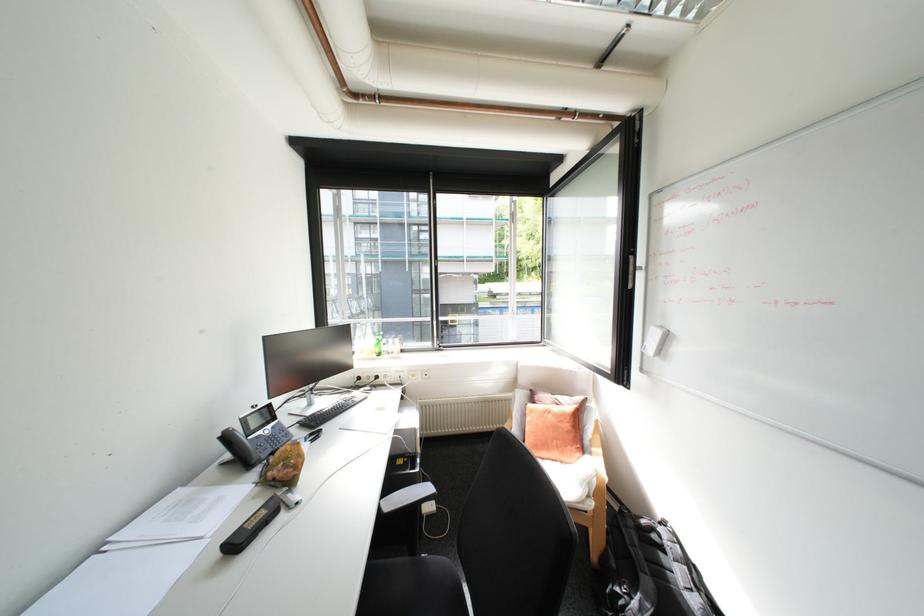
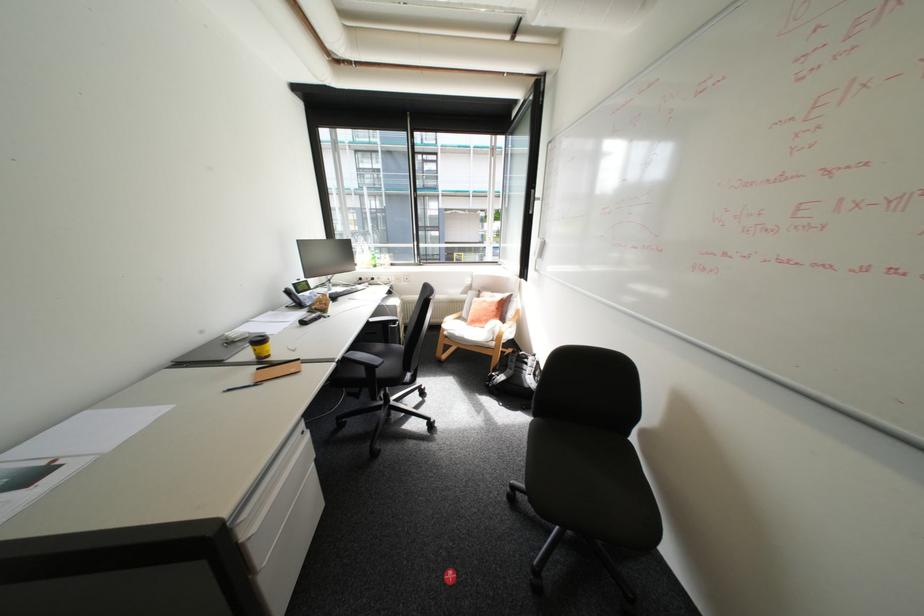
In a continuous first-person perspective shot, in which direction is the camera moving?

The movement direction of the cameraman is right, backward.